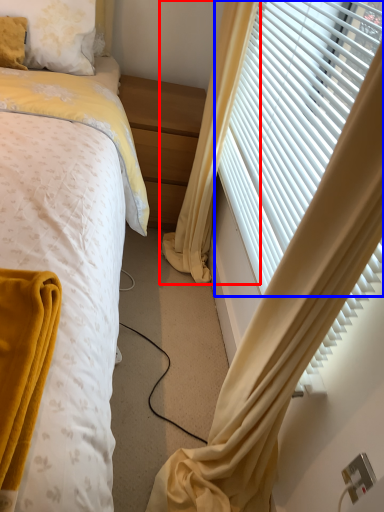
Question: Which point is closer to the camera, curtain (highlighted by a red box) or window blind (highlighted by a blue box)?

Choices:
 (A) curtain
 (B) window blind

Answer: (B)